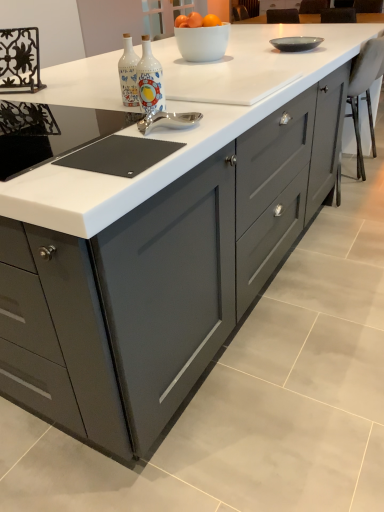
Question: From a real-world perspective, is black glass gas stove at center above or below matte gray bowl at upper right?

Choices:
 (A) above
 (B) below

Answer: (B)

Question: Considering the positions of point (31, 154) and point (286, 48), is point (31, 154) closer or farther from the camera than point (286, 48)?

Choices:
 (A) closer
 (B) farther

Answer: (A)

Question: Based on their relative distances, which object is farther from the white fabric chair at right?

Choices:
 (A) black glass gas stove at center
 (B) decorative ceramic bottles at center
 (C) matte gray bowl at upper right
 (D) orange matte at upper center

Answer: (A)

Question: Estimate the real-world distances between objects in this image. Which object is farther from the white fabric chair at right?

Choices:
 (A) orange matte at upper center
 (B) matte gray bowl at upper right
 (C) decorative ceramic bottles at center
 (D) black glass gas stove at center

Answer: (D)